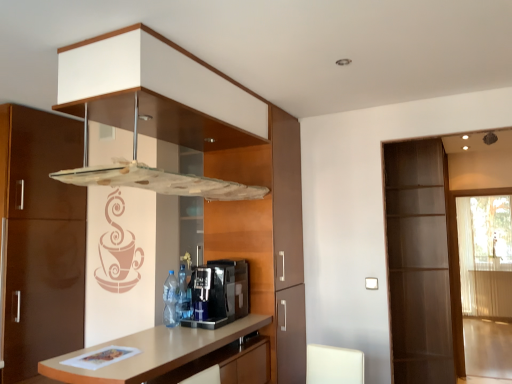
This screenshot has height=384, width=512. I want to click on vacant area that lies to the right of blue plastic bottle at center, the first bottle from the front, so click(202, 328).